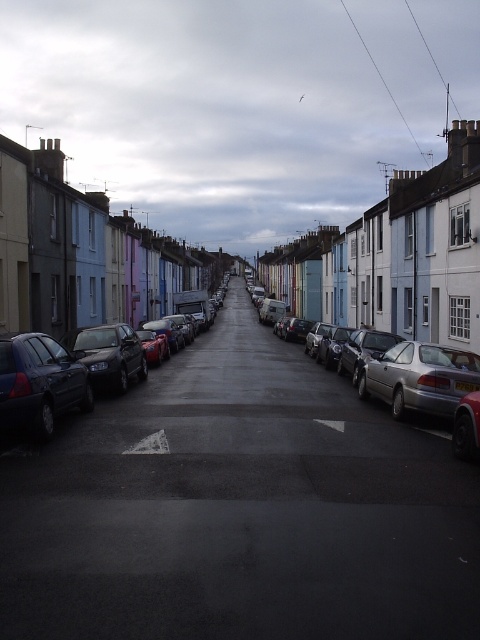
You are a delivery driver who needs to park your car between the matte black car at left and the silver metallic car at right. Is there enough space between them to fit your car which is 4.5 meters long?

The matte black car at left is to the left of the silver metallic car at right. However, the distance between them isn not specified in the provided information, so it is impossible to determine if there is enough space for a 4.5 meter long car.

You are a delivery driver who needs to park your car between the matte black car at left and the silver metallic car at right. According to the scene, which side of the road should you choose to park on?

The matte black car at left is located above the silver metallic car at right, which means they are parked on opposite sides of the road. Therefore, you should park on the same side as the silver metallic car at right to be between them.